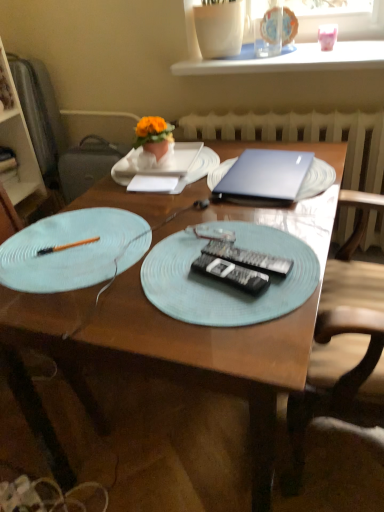
This screenshot has width=384, height=512. What are the coordinates of `free point in front of black plastic remote control at center, acting as the first remote control starting from the top` in the screenshot? It's located at (248, 318).